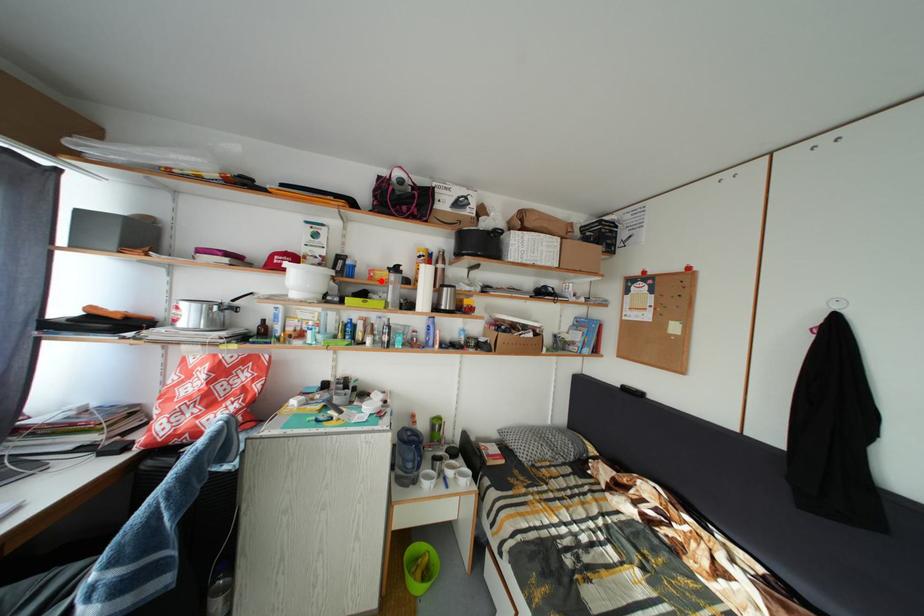
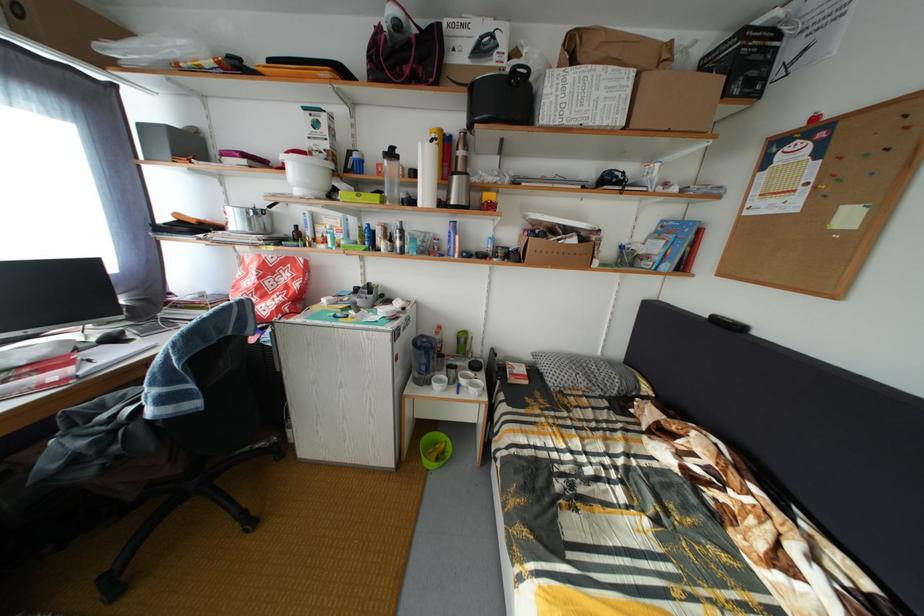
The point at the highlighted location is marked in the first image. Where is the corresponding point in the second image?

(388, 176)